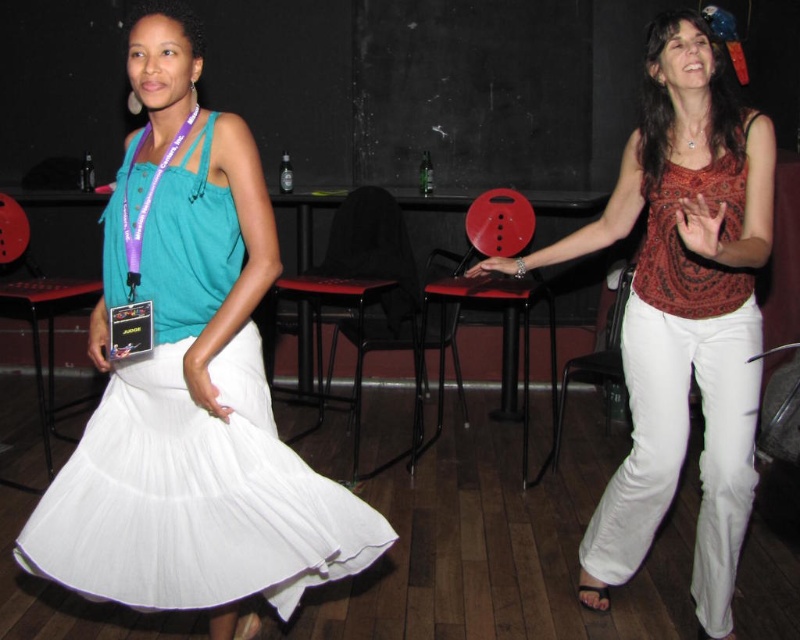
Question: Is white pleated skirt at center to the right of matte red blouse at center from the viewer's perspective?

Choices:
 (A) no
 (B) yes

Answer: (A)

Question: Which object appears closest to the camera in this image?

Choices:
 (A) white pleated skirt at center
 (B) matte red blouse at center

Answer: (A)

Question: Which point is farther from the camera taking this photo?

Choices:
 (A) tap(288, 536)
 (B) tap(645, 282)

Answer: (B)

Question: Among these objects, which one is nearest to the camera?

Choices:
 (A) white pleated skirt at center
 (B) matte red blouse at center

Answer: (A)

Question: Considering the relative positions of white pleated skirt at center and matte red blouse at center in the image provided, where is white pleated skirt at center located with respect to matte red blouse at center?

Choices:
 (A) left
 (B) right

Answer: (A)

Question: Is white pleated skirt at center smaller than matte red blouse at center?

Choices:
 (A) no
 (B) yes

Answer: (B)